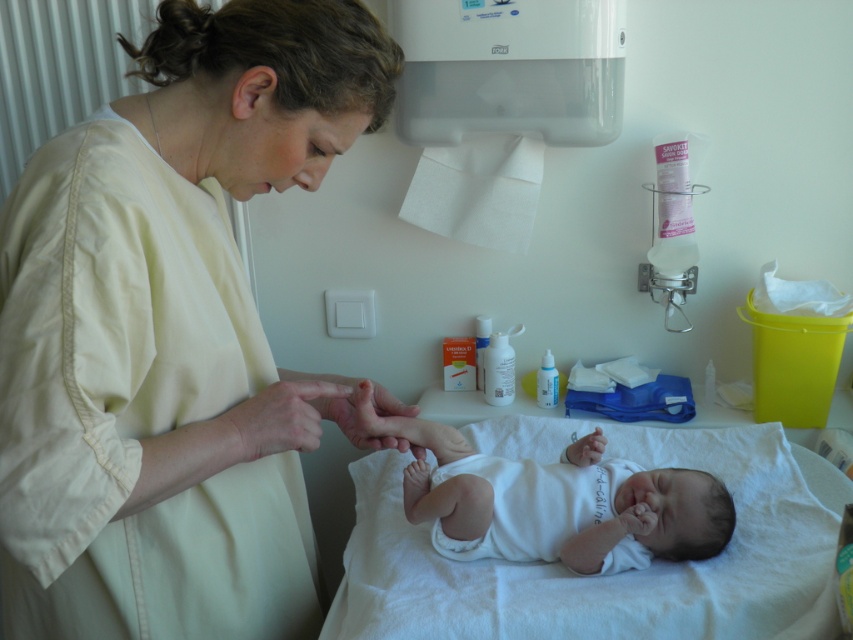
Question: Considering the relative positions of white soft hospital bed at center and white cotton newborn at center in the image provided, where is white soft hospital bed at center located with respect to white cotton newborn at center?

Choices:
 (A) below
 (B) above

Answer: (A)

Question: Among these objects, which one is nearest to the camera?

Choices:
 (A) white cotton newborn at center
 (B) smooth skin hand at center

Answer: (B)

Question: Which is farther from the smooth skin hand at center?

Choices:
 (A) matte white gown at center
 (B) white soft hospital bed at center
 (C) white cotton newborn at center

Answer: (B)

Question: Among these objects, which one is farthest from the camera?

Choices:
 (A) white soft hospital bed at center
 (B) smooth skin hand at center

Answer: (B)

Question: Considering the relative positions of matte white gown at center and smooth skin hand at center in the image provided, where is matte white gown at center located with respect to smooth skin hand at center?

Choices:
 (A) below
 (B) above

Answer: (B)

Question: Observing the image, what is the correct spatial positioning of white soft hospital bed at center in reference to white cotton newborn at center?

Choices:
 (A) below
 (B) above

Answer: (A)